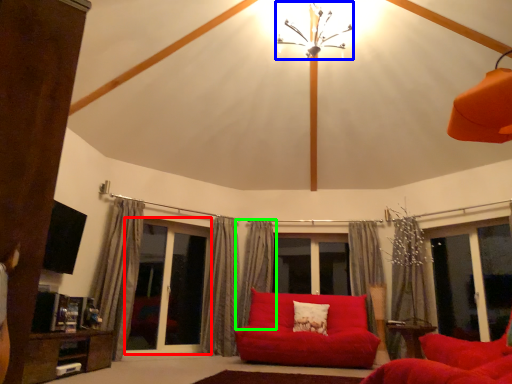
Question: Considering the real-world distances, which object is farthest from screen door (highlighted by a red box)? light fixture (highlighted by a blue box) or curtain (highlighted by a green box)?

Choices:
 (A) light fixture
 (B) curtain

Answer: (A)